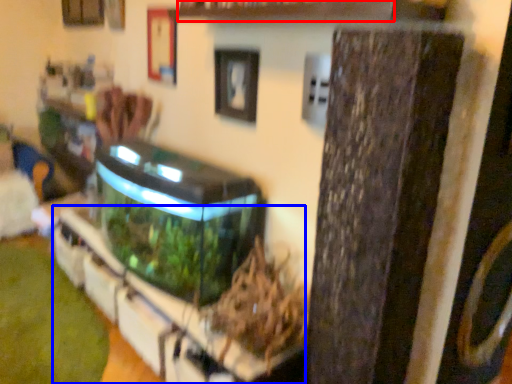
Question: Among these objects, which one is farthest to the camera, shelf (highlighted by a red box) or shelf (highlighted by a blue box)?

Choices:
 (A) shelf
 (B) shelf

Answer: (B)